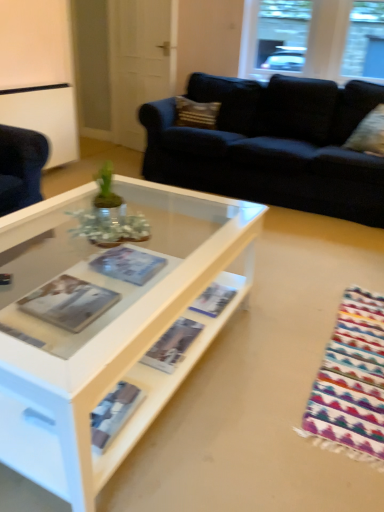
Question: Is matte paper magazine at center, the 3th magazine when ordered from right to left, taller or shorter than textured beige pillow at upper center, arranged as the second pillow when viewed from the front?

Choices:
 (A) tall
 (B) short

Answer: (B)

Question: From the image's perspective, is matte paper magazine at center, arranged as the 1th magazine when viewed from the left, above or below textured beige pillow at upper center, the first pillow positioned from the left?

Choices:
 (A) above
 (B) below

Answer: (B)

Question: Which is nearer to the velvet beige pillow at upper right, the 2th pillow viewed from the left?

Choices:
 (A) matte paper magazine at center, the 3th magazine when ordered from right to left
 (B) clear glass window at upper center
 (C) white glossy coffee table at center
 (D) matte paper magazine at center, which is the 3th magazine from left to right
 (E) matte paper magazine at center, the second magazine positioned from the right

Answer: (B)

Question: Which of these objects is positioned closest to the textured beige pillow at upper center, the first pillow positioned from the left?

Choices:
 (A) matte paper magazine at center, the second magazine positioned from the right
 (B) matte paper magazine at center, arranged as the 1th magazine when viewed from the left
 (C) clear glass window at upper center
 (D) white glossy coffee table at center
 (E) matte paper magazine at center, which is the 3th magazine from left to right

Answer: (C)